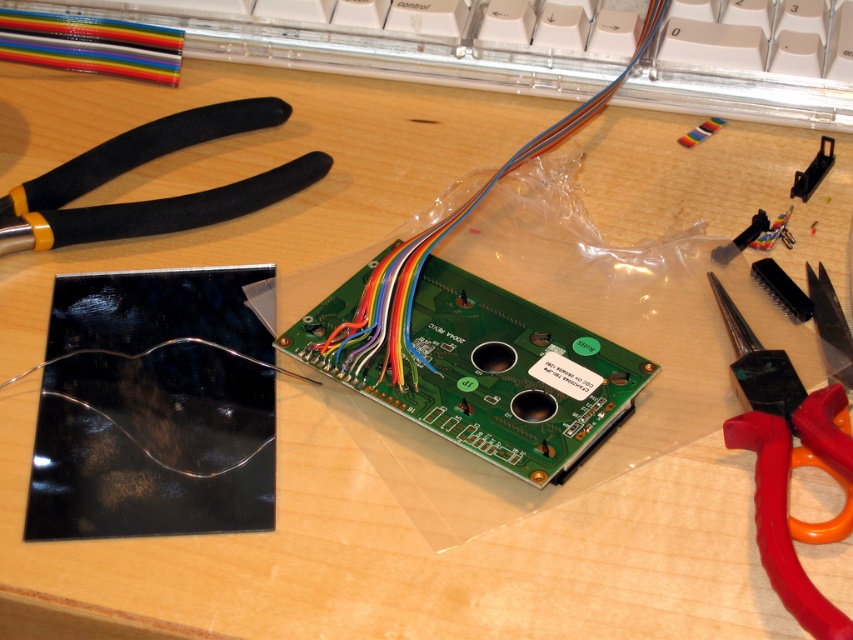
Question: Is black rubberized scissors at upper left positioned in front of red plastic scissors at lower right?

Choices:
 (A) yes
 (B) no

Answer: (B)

Question: Estimate the real-world distances between objects in this image. Which object is farther from the red plastic scissors at lower right?

Choices:
 (A) black rubberized scissors at upper left
 (B) rainbow cable at center
 (C) black plastic bracket at upper right
 (D) black plastic screwdriver at upper right

Answer: (A)

Question: Which point is farther to the camera?

Choices:
 (A) (122, 205)
 (B) (727, 248)

Answer: (A)

Question: Observing the image, what is the correct spatial positioning of red plastic scissors at lower right in reference to rainbow cable at center?

Choices:
 (A) above
 (B) below

Answer: (B)

Question: Which object is positioned farthest from the black plastic screwdriver at upper right?

Choices:
 (A) black plastic bracket at upper right
 (B) black rubberized scissors at upper left
 (C) rainbow cable at center

Answer: (B)

Question: Does red plastic scissors at lower right have a smaller size compared to black plastic bracket at upper right?

Choices:
 (A) no
 (B) yes

Answer: (A)